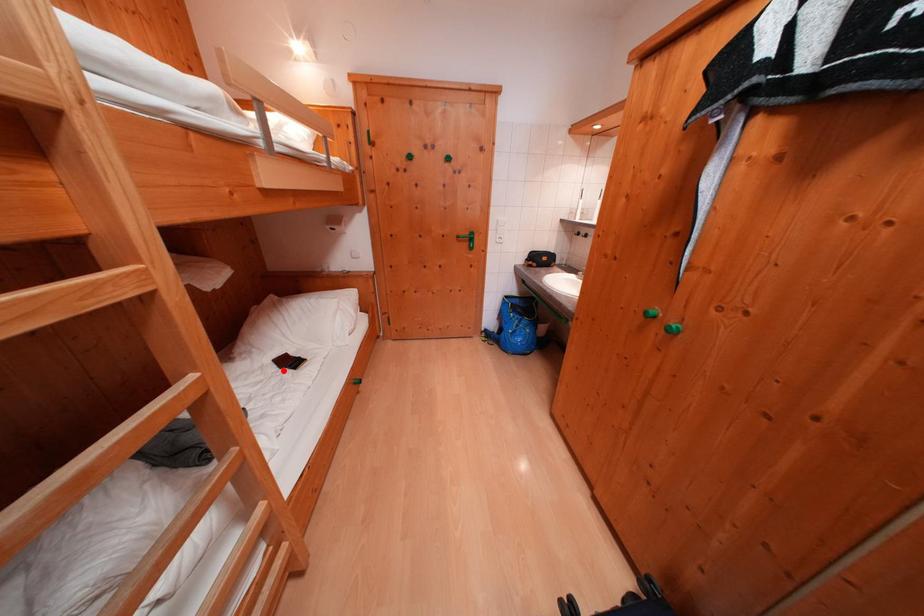
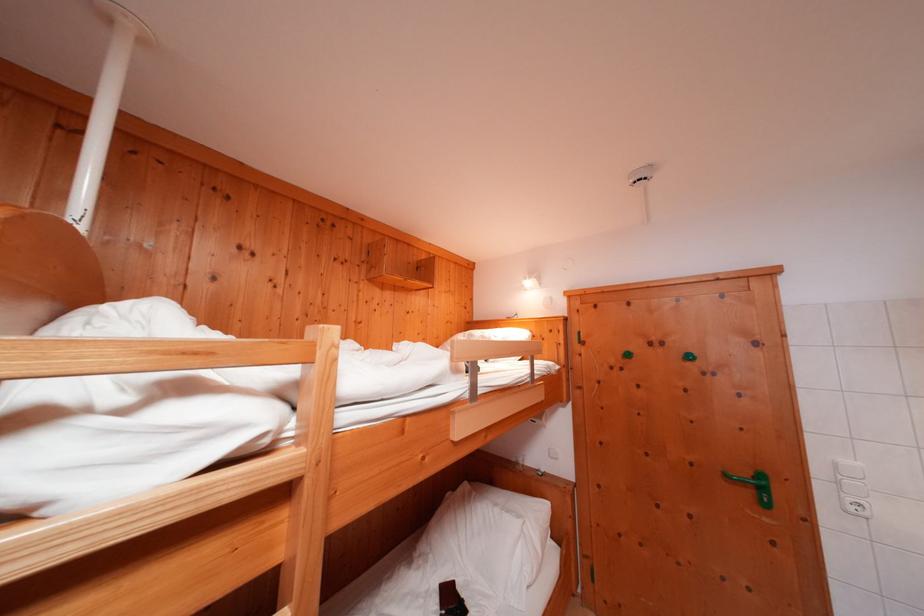
The point at the highlighted location is marked in the first image. Where is the corresponding point in the second image?

(446, 604)